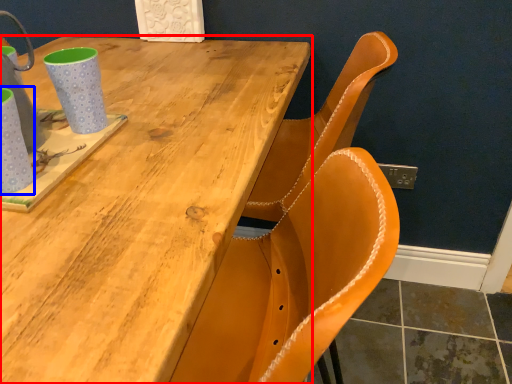
Question: Which object appears closest to the camera in this image, table (highlighted by a red box) or mug (highlighted by a blue box)?

Choices:
 (A) table
 (B) mug

Answer: (A)